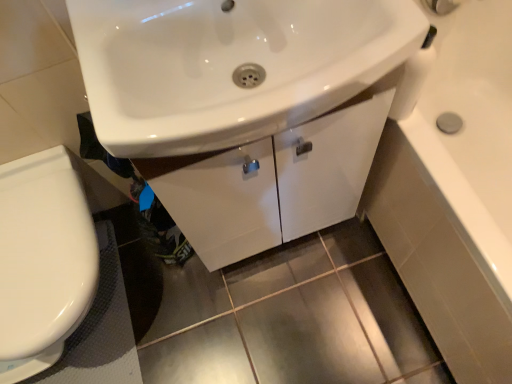
Identify the location of free region on the left part of white glossy faucet at upper center. (132, 34).